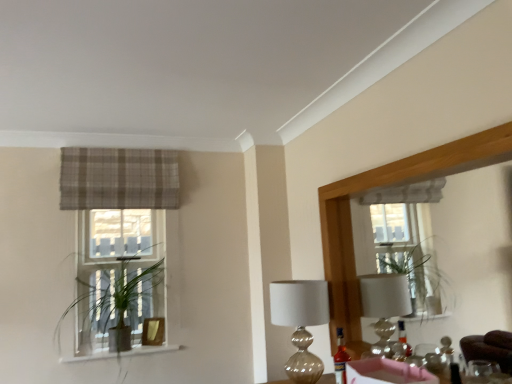
Question: Does wooden mirror at upper right have a greater height compared to translucent glass bottle at center?

Choices:
 (A) no
 (B) yes

Answer: (B)

Question: From a real-world perspective, is wooden mirror at upper right on translucent glass bottle at center?

Choices:
 (A) yes
 (B) no

Answer: (A)

Question: Is wooden mirror at upper right not close to translucent glass bottle at center?

Choices:
 (A) no
 (B) yes

Answer: (A)

Question: Is wooden mirror at upper right to the left of translucent glass bottle at center from the viewer's perspective?

Choices:
 (A) no
 (B) yes

Answer: (A)

Question: Considering the relative positions of wooden mirror at upper right and translucent glass bottle at center in the image provided, is wooden mirror at upper right in front of translucent glass bottle at center?

Choices:
 (A) no
 (B) yes

Answer: (B)

Question: Would you say wooden mirror at upper right is outside translucent glass bottle at center?

Choices:
 (A) yes
 (B) no

Answer: (A)

Question: Is matte wood window sill at lower left to the left of plaid fabric curtain at upper left from the viewer's perspective?

Choices:
 (A) no
 (B) yes

Answer: (B)

Question: Is matte wood window sill at lower left far from plaid fabric curtain at upper left?

Choices:
 (A) yes
 (B) no

Answer: (A)

Question: Does matte wood window sill at lower left have a smaller size compared to plaid fabric curtain at upper left?

Choices:
 (A) yes
 (B) no

Answer: (A)

Question: Is matte wood window sill at lower left in contact with plaid fabric curtain at upper left?

Choices:
 (A) no
 (B) yes

Answer: (A)

Question: Considering the relative sizes of matte wood window sill at lower left and plaid fabric curtain at upper left in the image provided, is matte wood window sill at lower left bigger than plaid fabric curtain at upper left?

Choices:
 (A) yes
 (B) no

Answer: (B)

Question: From a real-world perspective, is matte wood window sill at lower left over plaid fabric curtain at upper left?

Choices:
 (A) no
 (B) yes

Answer: (A)

Question: Is plaid fabric curtain at upper left bigger than wooden mirror at upper right?

Choices:
 (A) no
 (B) yes

Answer: (A)